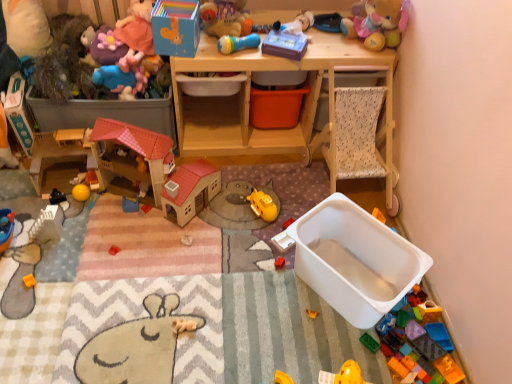
At what (x,y) coordinates should I click in order to perform the action: click on free spot to the left of translucent plastic car at lower right, placed as the 12th toy when sorted from left to right. Please return your answer as a coordinate pair (x, y). The height and width of the screenshot is (384, 512). Looking at the image, I should click on (389, 313).